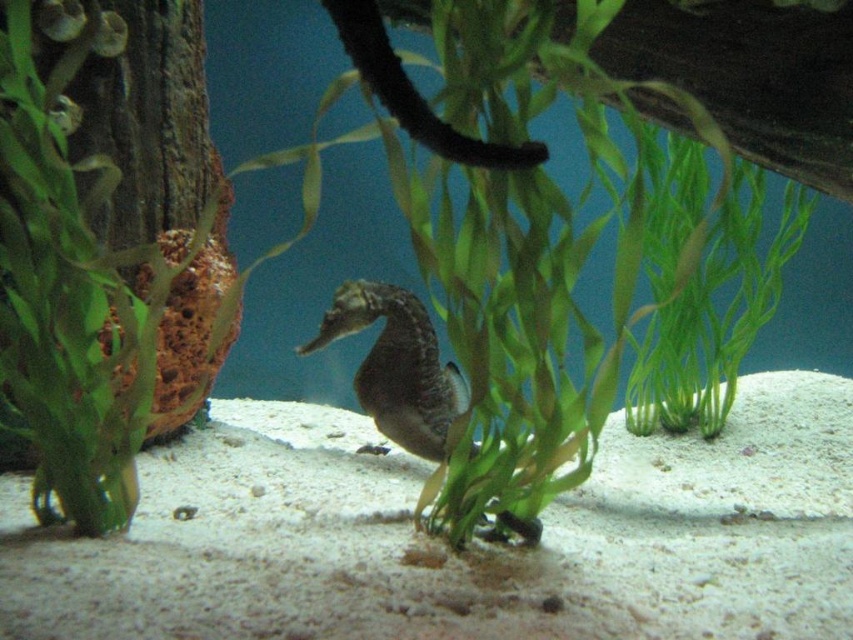
You are an underwater photographer aiming to capture the green leafy plant at center and the smooth gray seahorse at center in a single frame. Based on their sizes, which object will occupy more space in your camera view?

The green leafy plant at center will occupy more space in your camera view because its width surpasses that of the smooth gray seahorse at center.

You are an underwater photographer aiming to capture a closeup shot of the green leafy plant at center. Your camera has a maximum focus range of 3 feet. Can you take the photo without moving closer?

The green leafy plant at center is 3.61 feet from viewer, which is beyond the camera maximum focus range of 3 feet. You need to move closer to take the photo.

You are a marine biologist observing an aquarium. You notice a green leafy plant at center marked by point (505, 276). Is this plant closer to the bottom or the top of the aquarium?

The green leafy plant at center is represented by point (505, 276), which is closer to the bottom of the aquarium since the y coordinate 0.593 is closer to 1.0 than 0.0 in a coordinate system where the bottom is 1.0 and the top is 0.0.